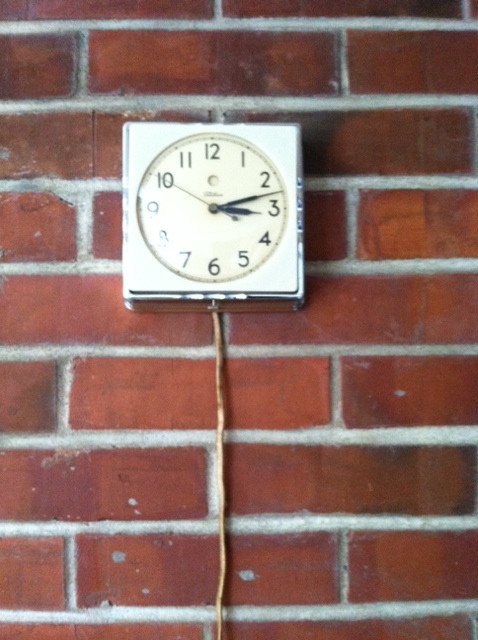
Image resolution: width=478 pixels, height=640 pixels. In order to click on metal rim around clock in this screenshot , I will do [x=302, y=211], [x=225, y=299], [x=127, y=218], [x=210, y=125].